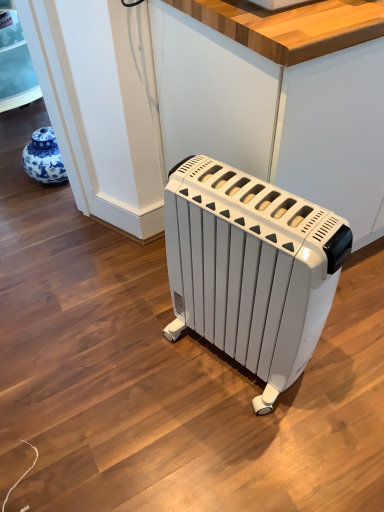
What are the coordinates of `free space in front of white plastic radiator at center` in the screenshot? It's located at (250, 448).